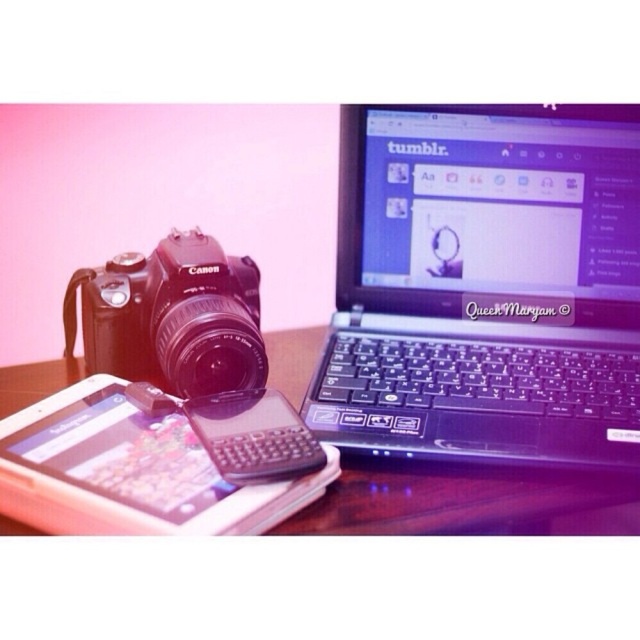
You are trying to reach for the white plastic tablet at lower left and the wooden table at center. Which object is closer to you?

The white plastic tablet at lower left is closer to the viewer than the wooden table at center, so you can reach it first.

You are a photographer setting up equipment. You have a Canon DSLR camera on the left and a white plastic tablet at lower left. You need to place a 20 inch tripod between them. Is there enough space?

The distance between the Canon DSLR camera and the white plastic tablet at lower left is 19.21 inches. Since the tripod requires 20 inches, there isn t enough space to place it between them.